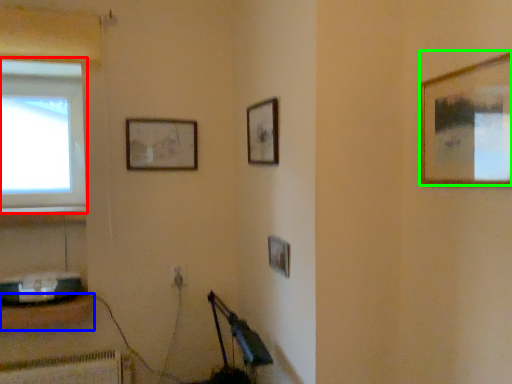
Question: Which object is positioned farthest from window (highlighted by a red box)? Select from furniture (highlighted by a blue box) and picture frame (highlighted by a green box).

Choices:
 (A) furniture
 (B) picture frame

Answer: (B)